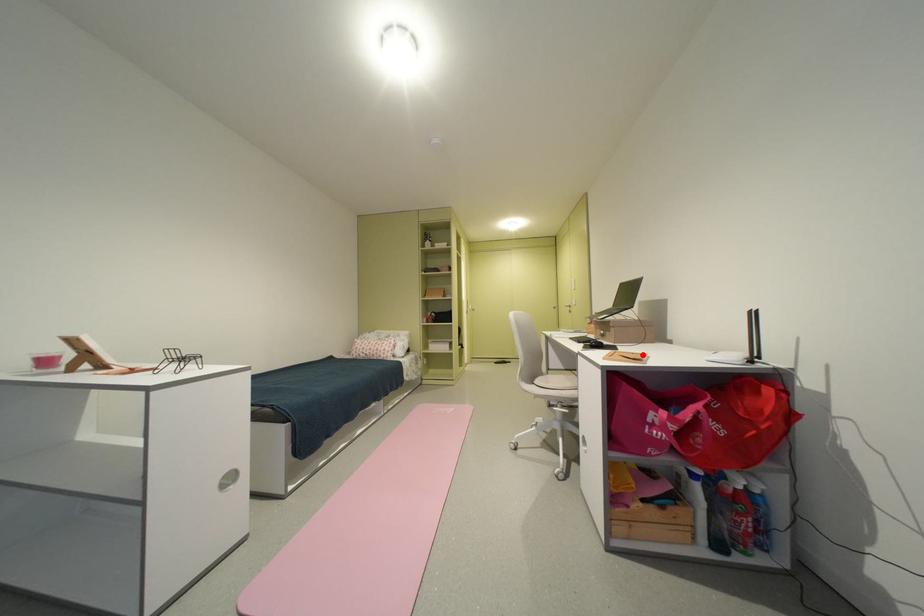
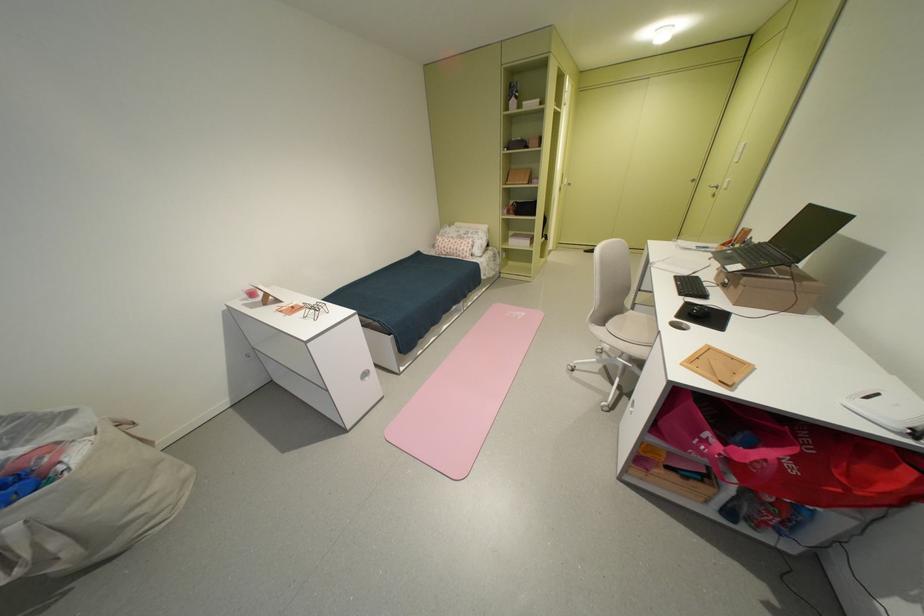
In the second image, find the point that corresponds to the highlighted location in the first image.

(743, 360)